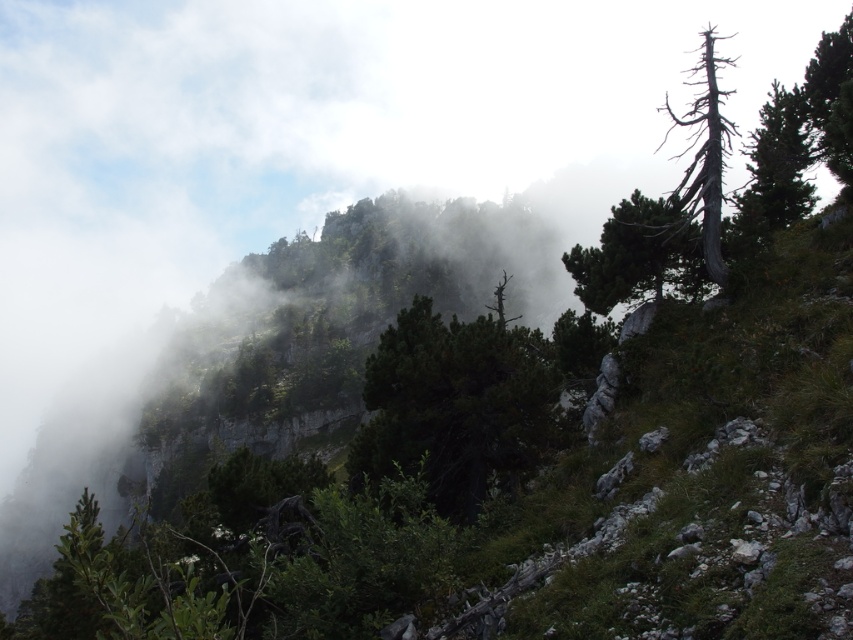
Question: Among these objects, which one is nearest to the camera?

Choices:
 (A) green textured pine tree at upper right
 (B) green matte tree at center
 (C) charcoal gray bark tree at upper right
 (D) green matte tree at upper right

Answer: (B)

Question: Is green matte tree at upper right to the right of charcoal gray bark tree at upper right from the viewer's perspective?

Choices:
 (A) yes
 (B) no

Answer: (B)

Question: In this image, where is green matte tree at center located relative to green textured pine tree at upper right?

Choices:
 (A) left
 (B) right

Answer: (A)

Question: Which point is closer to the camera taking this photo?

Choices:
 (A) (679, 264)
 (B) (711, 246)

Answer: (B)

Question: Among these points, which one is farthest from the camera?

Choices:
 (A) (714, 148)
 (B) (759, 202)
 (C) (662, 276)
 (D) (454, 374)

Answer: (B)

Question: Is green matte tree at upper right further to camera compared to green textured pine tree at upper right?

Choices:
 (A) yes
 (B) no

Answer: (B)